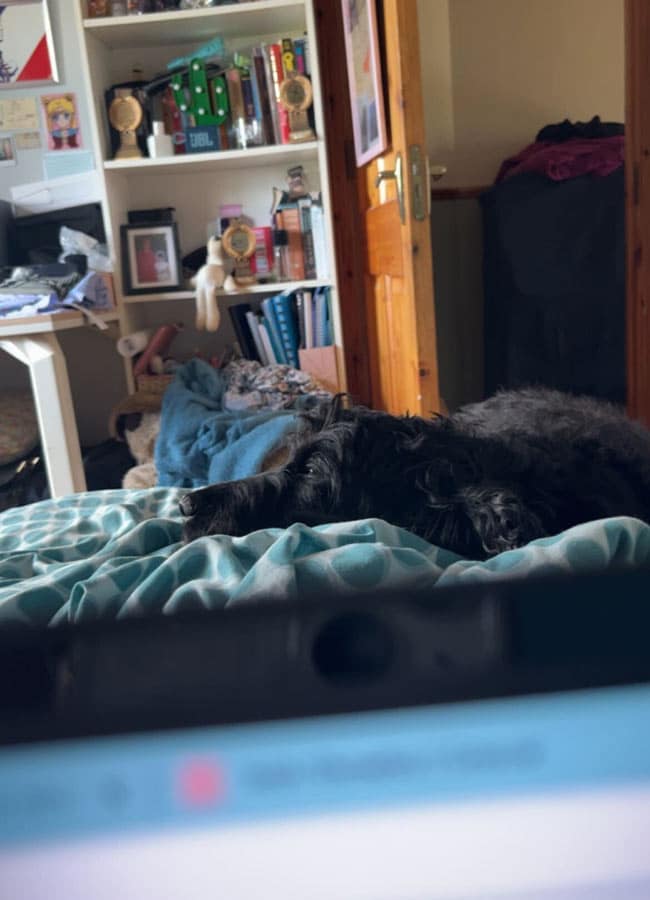
Find the location of `brown hardwood door`. brown hardwood door is located at coordinates (409, 334), (404, 110).